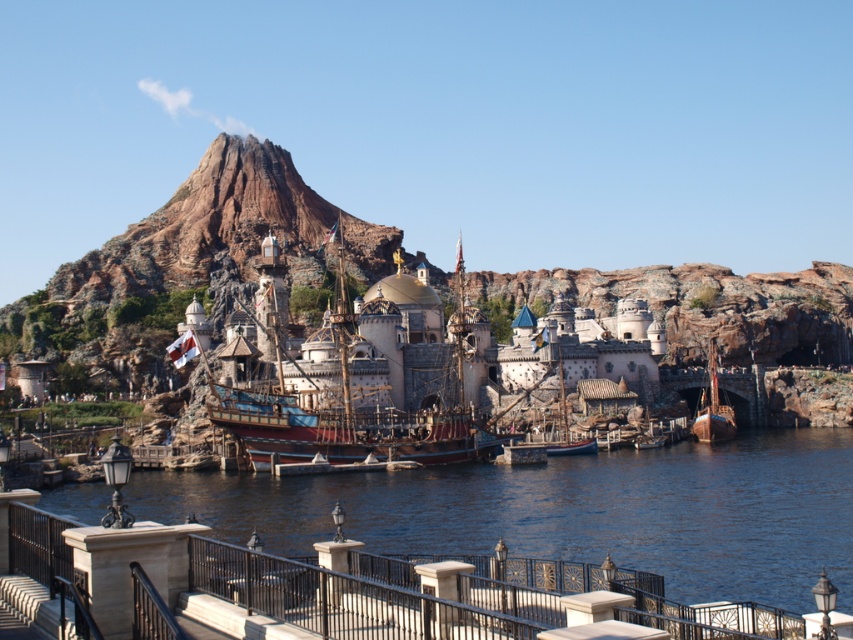
You are a visitor at the themed park and want to take a photo of the clear blue water at lower center and the wooden ship at center. Which object should you focus on first if you want to capture both in one frame without moving the camera?

The clear blue water at lower center is bigger than the wooden ship at center, so you should focus on the clear blue water at lower center first to ensure it fills the frame appropriately before adjusting for the smaller wooden ship at center.

You are a park visitor who wants to take a photo of both wooden ship at center and wooden ship at lower right from a distance. Which ship will appear wider in your photo?

The wooden ship at center will appear wider in the photo because its actual width is larger than the wooden ship at lower right.